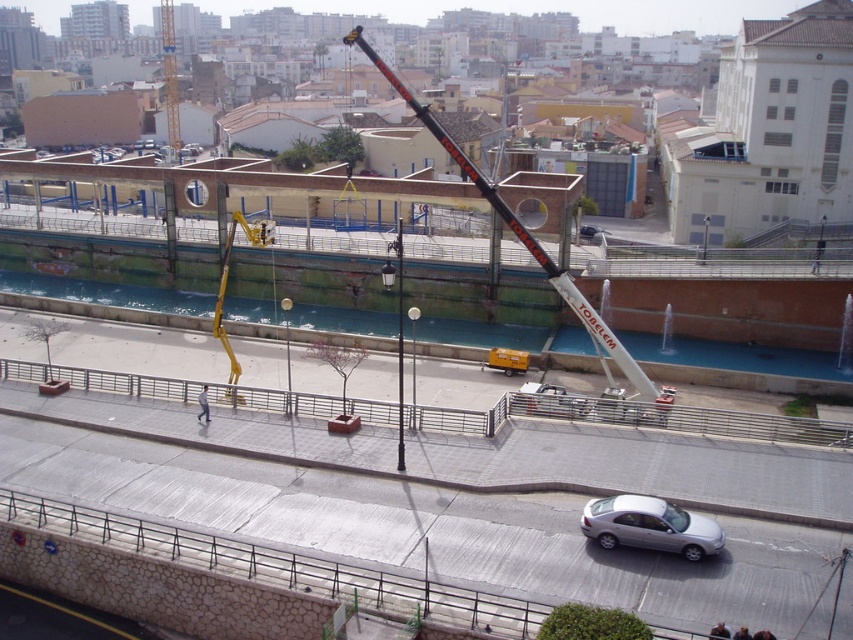
Is yellow metallic crane at center smaller than white fabric construction worker at center?

Incorrect, yellow metallic crane at center is not smaller in size than white fabric construction worker at center.

Is yellow metallic crane at center shorter than white fabric construction worker at center?

In fact, yellow metallic crane at center may be taller than white fabric construction worker at center.

The image size is (853, 640). Find the location of `yellow metallic crane at center`. yellow metallic crane at center is located at coordinates (225, 284).

Does point (604, 371) lie in front of point (170, 109)?

Yes, it is in front of point (170, 109).

Is point (653, 394) farther from camera compared to point (171, 44)?

That is False.

Where is `black metallic crane at center`? black metallic crane at center is located at coordinates (523, 236).

Which is below, silver metallic car at lower center or yellow metallic crane at upper left?

silver metallic car at lower center

Does silver metallic car at lower center have a lesser width compared to yellow metallic crane at upper left?

Correct, silver metallic car at lower center's width is less than yellow metallic crane at upper left's.

Measure the distance between silver metallic car at lower center and camera.

28.21 meters

Locate an element on the screen. The width and height of the screenshot is (853, 640). silver metallic car at lower center is located at coordinates (648, 525).